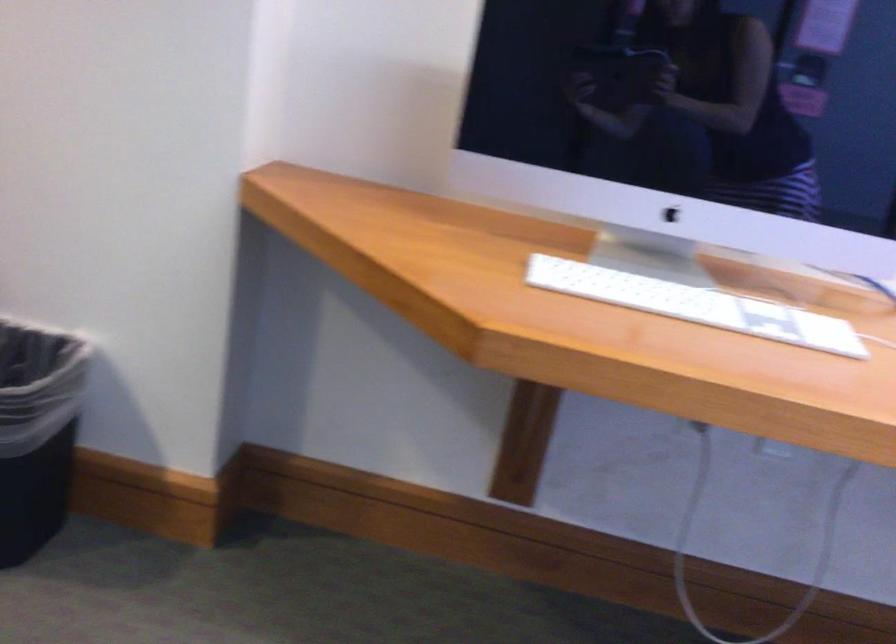
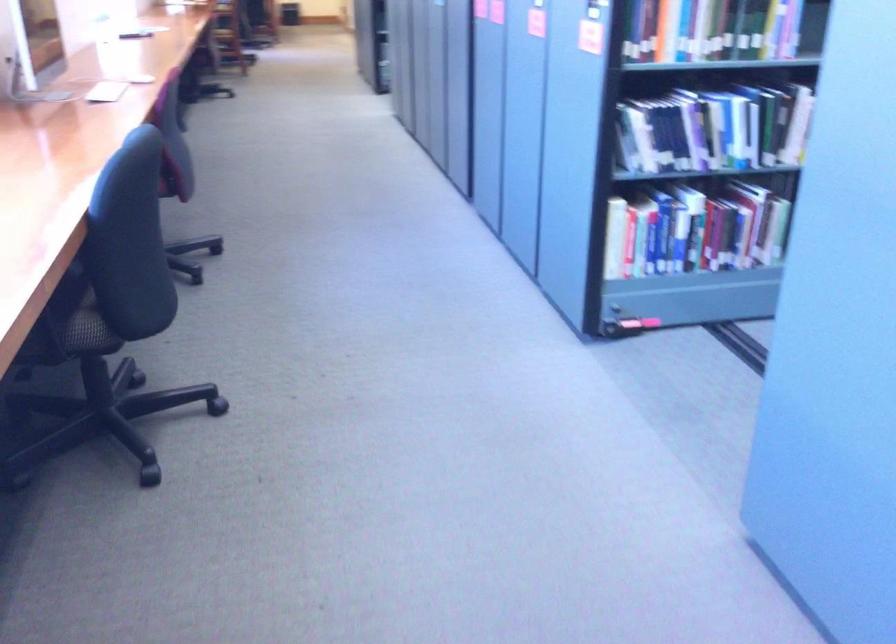
How did the camera likely rotate?

The camera rotated toward right-down.